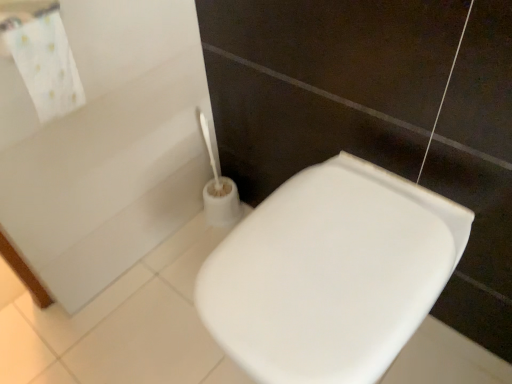
This screenshot has width=512, height=384. What are the coordinates of `white fabric towel at upper left` in the screenshot? It's located at (46, 66).

This screenshot has width=512, height=384. What do you see at coordinates (46, 66) in the screenshot?
I see `white fabric towel at upper left` at bounding box center [46, 66].

The image size is (512, 384). What do you see at coordinates (331, 274) in the screenshot?
I see `white glossy toilet seat at lower right` at bounding box center [331, 274].

Where is `white glossy toilet seat at lower right`? The height and width of the screenshot is (384, 512). white glossy toilet seat at lower right is located at coordinates (331, 274).

Where is `white fabric towel at upper left`? white fabric towel at upper left is located at coordinates (46, 66).

Considering the relative positions of white glossy toilet seat at lower right and white fabric towel at upper left in the image provided, is white glossy toilet seat at lower right to the left or to the right of white fabric towel at upper left?

From the image, it's evident that white glossy toilet seat at lower right is to the right of white fabric towel at upper left.

Which is behind, white glossy toilet seat at lower right or white fabric towel at upper left?

white fabric towel at upper left is more distant.

Considering the positions of point (284, 309) and point (31, 87), is point (284, 309) closer or farther from the camera than point (31, 87)?

Point (284, 309).

From the image's perspective, is white glossy toilet seat at lower right located beneath white fabric towel at upper left?

Yes.

From a real-world perspective, does white glossy toilet seat at lower right stand above white fabric towel at upper left?

No, from a real-world perspective, white glossy toilet seat at lower right is not over white fabric towel at upper left

Which object is thinner, white glossy toilet seat at lower right or white fabric towel at upper left?

With smaller width is white fabric towel at upper left.

Between white glossy toilet seat at lower right and white fabric towel at upper left, which one has more height?

white glossy toilet seat at lower right.

Which of these two, white glossy toilet seat at lower right or white fabric towel at upper left, is smaller?

With smaller size is white fabric towel at upper left.

In the scene shown: Would you say white glossy toilet seat at lower right contains white fabric towel at upper left?

No, white fabric towel at upper left is not surrounded by white glossy toilet seat at lower right.

Is white glossy toilet seat at lower right positioned far away from white fabric towel at upper left?

No, white glossy toilet seat at lower right is not far from white fabric towel at upper left.

Is white glossy toilet seat at lower right turned away from white fabric towel at upper left?

That's not correct — white glossy toilet seat at lower right is not looking away from white fabric towel at upper left.

What's the angular difference between white glossy toilet seat at lower right and white fabric towel at upper left's facing directions?

white glossy toilet seat at lower right and white fabric towel at upper left are facing 3.5 degrees away from each other.

The width and height of the screenshot is (512, 384). What are the coordinates of `toilet on the right of white fabric towel at upper left` in the screenshot? It's located at (331, 274).

Does white fabric towel at upper left appear on the right side of white glossy toilet seat at lower right?

In fact, white fabric towel at upper left is to the left of white glossy toilet seat at lower right.

Which object is closer to the camera taking this photo, white fabric towel at upper left or white glossy toilet seat at lower right?

white glossy toilet seat at lower right is more forward.

Is point (48, 90) positioned before point (230, 252)?

That is True.

From the image's perspective, is white fabric towel at upper left below white glossy toilet seat at lower right?

Incorrect, from the image's perspective, white fabric towel at upper left is higher than white glossy toilet seat at lower right.

From a real-world perspective, is white fabric towel at upper left positioned above or below white glossy toilet seat at lower right?

From a real-world perspective, white fabric towel at upper left is physically above white glossy toilet seat at lower right.

Is white fabric towel at upper left wider or thinner than white glossy toilet seat at lower right?

In the image, white fabric towel at upper left appears to be more narrow than white glossy toilet seat at lower right.

Based on the photo, which of these two, white fabric towel at upper left or white glossy toilet seat at lower right, stands taller?

white glossy toilet seat at lower right.

Considering the sizes of objects white fabric towel at upper left and white glossy toilet seat at lower right in the image provided, who is smaller, white fabric towel at upper left or white glossy toilet seat at lower right?

white fabric towel at upper left.

Is white glossy toilet seat at lower right completely or partially inside white fabric towel at upper left?

No, white glossy toilet seat at lower right is located outside of white fabric towel at upper left.

Would you consider white fabric towel at upper left to be distant from white glossy toilet seat at lower right?

No.

Is white fabric towel at upper left turned away from white glossy toilet seat at lower right?

white fabric towel at upper left is not turned away from white glossy toilet seat at lower right.

Find the location of `bath towel above the white glossy toilet seat at lower right (from the image's perspective)`. bath towel above the white glossy toilet seat at lower right (from the image's perspective) is located at coordinates (46, 66).

You are a GUI agent. You are given a task and a screenshot of the screen. Output one action in this format:
    pyautogui.click(x=<x>, y=<y>)
    Task: Click on the toilet located underneath the white fabric towel at upper left (from a real-world perspective)
    
    Given the screenshot: What is the action you would take?
    pyautogui.click(x=331, y=274)

The height and width of the screenshot is (384, 512). I want to click on bath towel on the left of white glossy toilet seat at lower right, so click(46, 66).